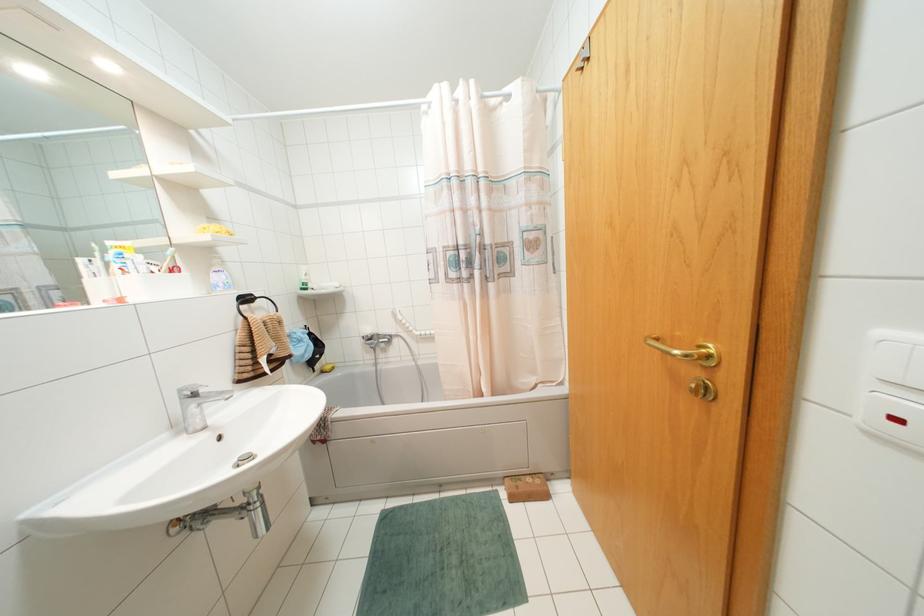
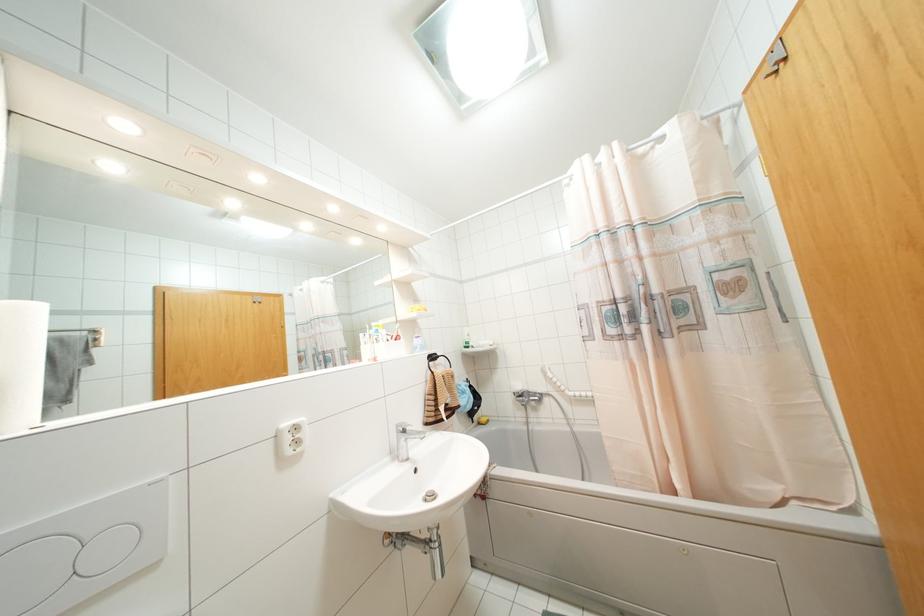
The point at [371,342] is marked in the first image. Where is the corresponding point in the second image?

(523, 400)